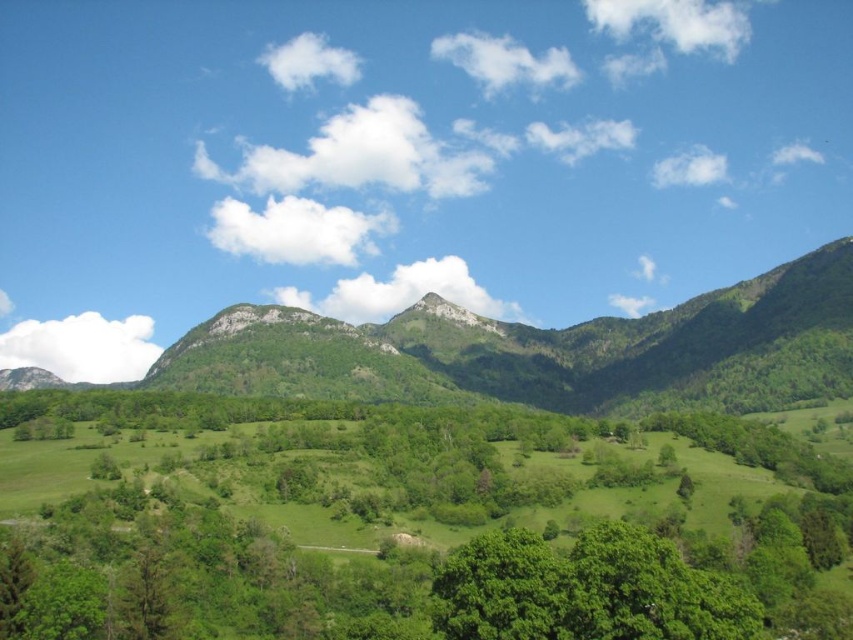
Based on the photo, can you confirm if green leafy tree at center is shorter than green leafy mountain at center?

Correct, green leafy tree at center is not as tall as green leafy mountain at center.

Can you confirm if green leafy tree at center is thinner than green leafy mountain at center?

Yes.

Who is more distant from viewer, (x=498, y=412) or (x=430, y=301)?

Point (x=430, y=301)

You are a GUI agent. You are given a task and a screenshot of the screen. Output one action in this format:
    pyautogui.click(x=<x>, y=<y>)
    Task: Click on the green leafy tree at center
    
    Given the screenshot: What is the action you would take?
    pyautogui.click(x=409, y=524)